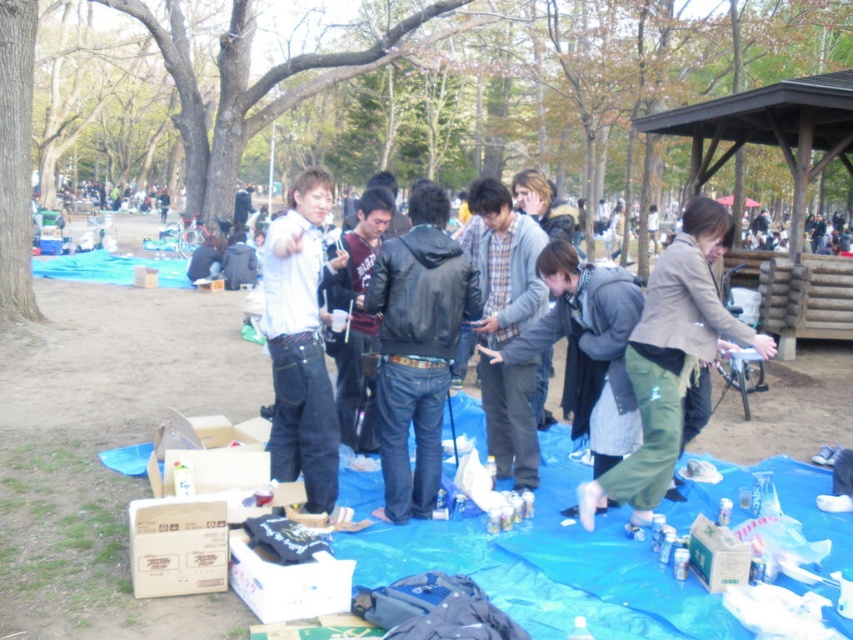
Question: Which point is farther to the camera?

Choices:
 (A) (669, 404)
 (B) (267, 294)

Answer: (A)

Question: Is matte brown jacket at center smaller than white matte jacket at center?

Choices:
 (A) yes
 (B) no

Answer: (B)

Question: In this image, where is black leather jacket at center located relative to white matte jacket at center?

Choices:
 (A) left
 (B) right

Answer: (B)

Question: Which object is positioned closest to the white matte jacket at center?

Choices:
 (A) matte brown jacket at center
 (B) black leather jacket at center

Answer: (B)

Question: Which object is the farthest from the white matte jacket at center?

Choices:
 (A) matte brown jacket at center
 (B) black leather jacket at center

Answer: (A)

Question: From the image, what is the correct spatial relationship of matte brown jacket at center in relation to white matte jacket at center?

Choices:
 (A) left
 (B) right

Answer: (B)